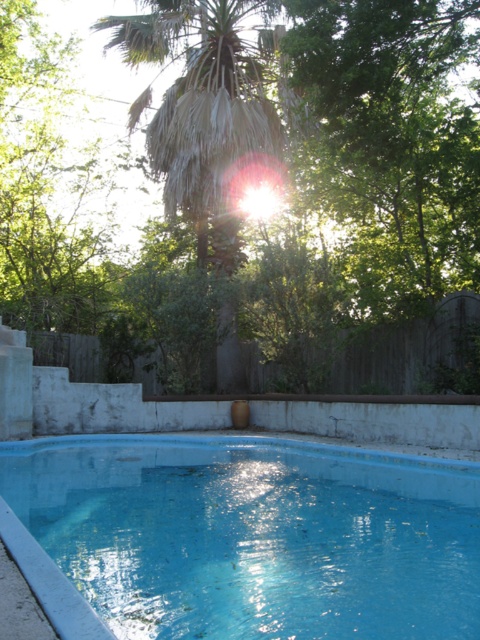
Question: From the image, what is the correct spatial relationship of green leafy tree at upper center in relation to blue painted concrete swimming pool at center?

Choices:
 (A) below
 (B) above

Answer: (B)

Question: Considering the relative positions of green leafy tree at upper center and blue painted concrete swimming pool at center in the image provided, where is green leafy tree at upper center located with respect to blue painted concrete swimming pool at center?

Choices:
 (A) below
 (B) above

Answer: (B)

Question: Which point is closer to the camera?

Choices:
 (A) blue painted concrete swimming pool at center
 (B) green leafy tree at upper center

Answer: (A)

Question: Is green leafy tree at upper center below blue painted concrete swimming pool at center?

Choices:
 (A) yes
 (B) no

Answer: (B)

Question: Which of the following is the closest to the observer?

Choices:
 (A) blue painted concrete swimming pool at center
 (B) green leafy tree at upper center

Answer: (A)